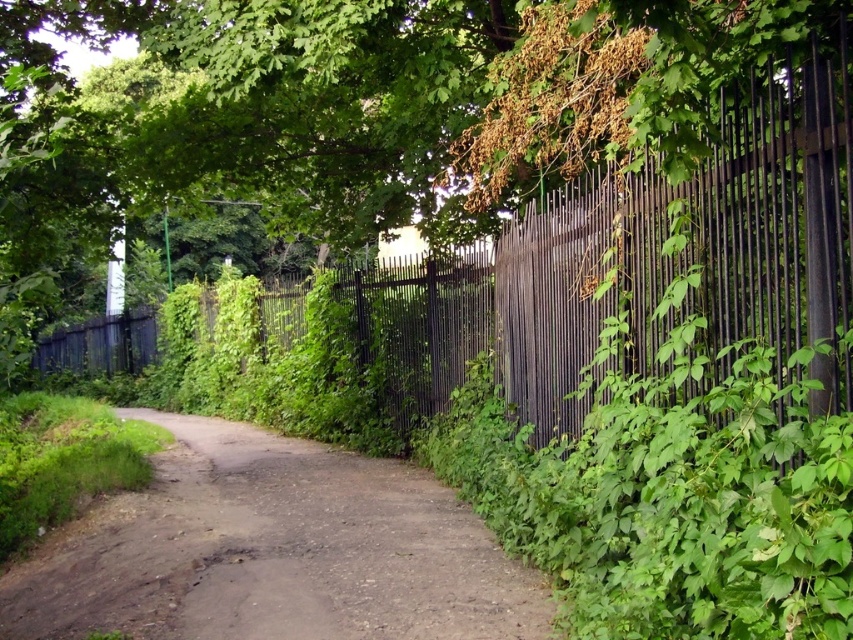
You are standing at the start of a hike and see the brown dirt track at center ahead of you. If you want to reach the track within 5 seconds, what is the minimum speed you need to walk at?

The brown dirt track at center is 4.79 meters away. To cover this distance in 5 seconds, you need to walk at a minimum speed of approximately 0.958 meters per second.

You are a painter carrying a 1.2 meter wide canvas. You want to walk along the dirt path while keeping your canvas upright. The path is bordered by the black metal fence at right and the black metal fence at center. Which fence will your canvas hit first if you continue walking straight?

The black metal fence at right is thinner than the black metal fence at center, so the canvas will hit the black metal fence at right first because it is closer to the path.

You are a hiker walking along the dirt path and want to know which fence is taller. You see the black metal fence at right and the black metal fence at center. Which one is taller?

The black metal fence at center is taller than the black metal fence at right.